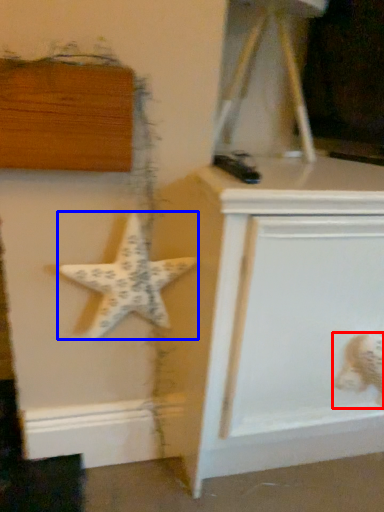
Question: Which object appears closest to the camera in this image, toy (highlighted by a red box) or starfish (highlighted by a blue box)?

Choices:
 (A) toy
 (B) starfish

Answer: (B)